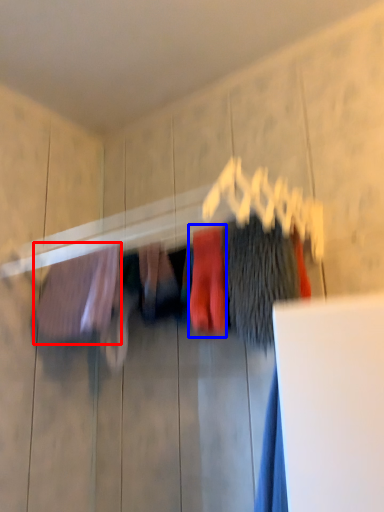
Question: Which of the following is the farthest to the observer, clothing (highlighted by a red box) or clothing (highlighted by a blue box)?

Choices:
 (A) clothing
 (B) clothing

Answer: (A)